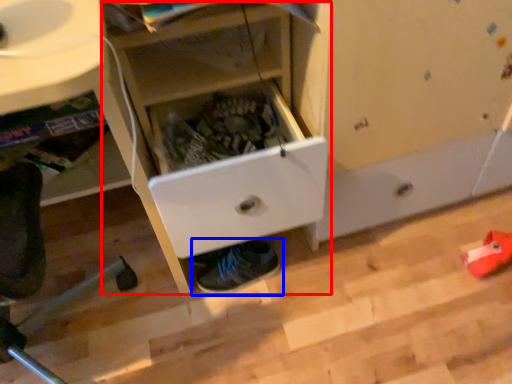
Question: Among these objects, which one is farthest to the camera, cabinetry (highlighted by a red box) or footwear (highlighted by a blue box)?

Choices:
 (A) cabinetry
 (B) footwear

Answer: (B)